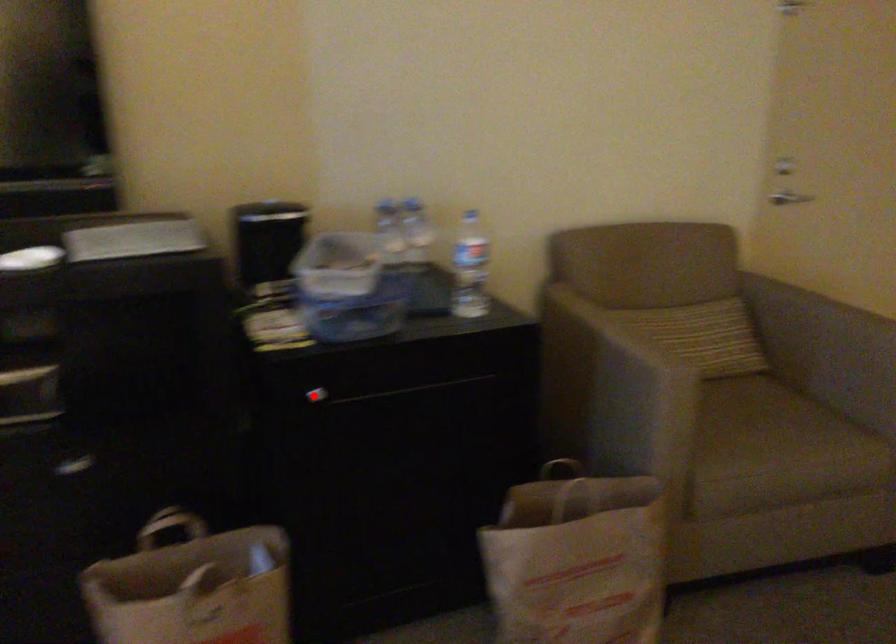
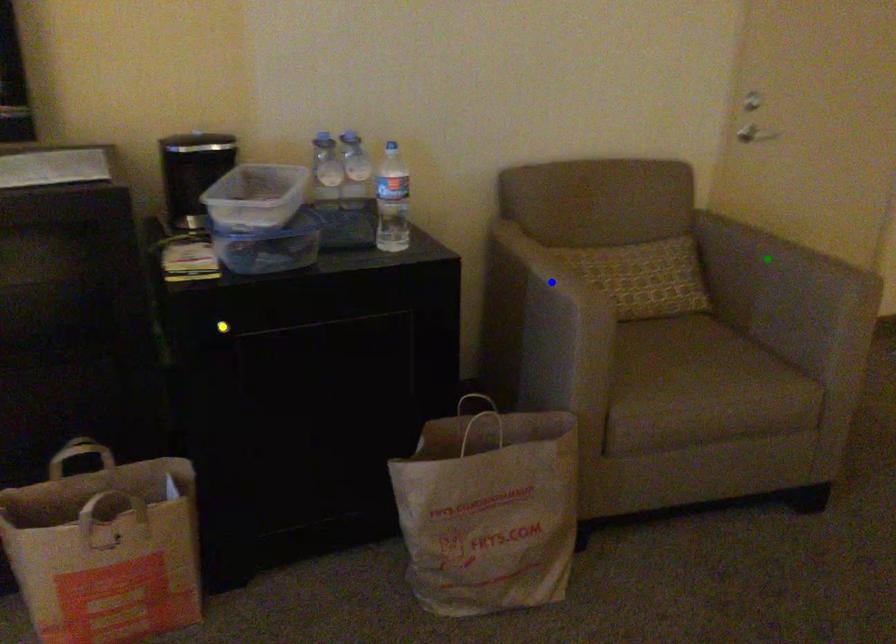
Question: I am providing you with two images of the same scene from different viewpoints. A red point is marked on the first image. You are given multiple points on the second image. Can you choose the point in image 2 that corresponds to the point in image 1?

Choices:
 (A) yellow point
 (B) green point
 (C) blue point

Answer: (A)